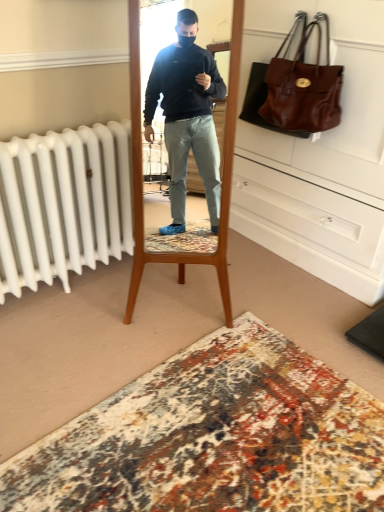
Describe the element at coordinates (319, 155) in the screenshot. I see `matte brown leather dresser at upper right` at that location.

This screenshot has height=512, width=384. What are the coordinates of `brown leather handbag at upper right` in the screenshot? It's located at (303, 85).

What is the approximate width of carpet with intricate patterns at lower center?

carpet with intricate patterns at lower center is 1.36 meters in width.

Find the location of a particular element. matte brown leather dresser at upper right is located at coordinates (319, 155).

Is brown leather handbag at upper right aimed at carpet with intricate patterns at lower center?

No, brown leather handbag at upper right is not facing towards carpet with intricate patterns at lower center.

How much distance is there between brown leather handbag at upper right and carpet with intricate patterns at lower center?

brown leather handbag at upper right is 4.43 feet from carpet with intricate patterns at lower center.

Does brown leather handbag at upper right have a lesser width compared to carpet with intricate patterns at lower center?

Yes, brown leather handbag at upper right is thinner than carpet with intricate patterns at lower center.

Is point (300, 68) closer to camera compared to point (164, 379)?

No, (300, 68) is behind (164, 379).

From a real-world perspective, is matte brown leather dresser at upper right positioned above or below carpet with intricate patterns at lower center?

matte brown leather dresser at upper right is situated higher than carpet with intricate patterns at lower center in the real world.

Are matte brown leather dresser at upper right and carpet with intricate patterns at lower center located far from each other?

matte brown leather dresser at upper right is far away from carpet with intricate patterns at lower center.

Would you say matte brown leather dresser at upper right is to the left or to the right of carpet with intricate patterns at lower center in the picture?

Clearly, matte brown leather dresser at upper right is on the right of carpet with intricate patterns at lower center in the image.

Do you think matte brown leather dresser at upper right is within carpet with intricate patterns at lower center, or outside of it?

matte brown leather dresser at upper right is outside carpet with intricate patterns at lower center.

Which of these two, carpet with intricate patterns at lower center or brown leather handbag at upper right, is smaller?

brown leather handbag at upper right.

Where is `handbag that appears above the carpet with intricate patterns at lower center (from a real-world perspective)`? This screenshot has width=384, height=512. handbag that appears above the carpet with intricate patterns at lower center (from a real-world perspective) is located at coordinates (303, 85).

Consider the image. In terms of height, does carpet with intricate patterns at lower center look taller or shorter compared to brown leather handbag at upper right?

Clearly, carpet with intricate patterns at lower center is shorter compared to brown leather handbag at upper right.

Is brown leather handbag at upper right a part of carpet with intricate patterns at lower center?

No.

Relative to matte brown leather dresser at upper right, is brown leather handbag at upper right in front or behind?

Visually, brown leather handbag at upper right is located behind matte brown leather dresser at upper right.

This screenshot has height=512, width=384. What are the coordinates of `dresser below the brown leather handbag at upper right (from the image's perspective)` in the screenshot? It's located at (319, 155).

From a real-world perspective, is brown leather handbag at upper right physically below matte brown leather dresser at upper right?

No.

From the image's perspective, who appears lower, brown leather handbag at upper right or matte brown leather dresser at upper right?

matte brown leather dresser at upper right is shown below in the image.

Is matte brown leather dresser at upper right directly adjacent to brown leather handbag at upper right?

No, matte brown leather dresser at upper right is not next to brown leather handbag at upper right.

Can you confirm if matte brown leather dresser at upper right is smaller than brown leather handbag at upper right?

No, matte brown leather dresser at upper right is not smaller than brown leather handbag at upper right.

Does point (239, 149) come behind point (307, 103)?

That is True.

Is carpet with intricate patterns at lower center turned away from matte brown leather dresser at upper right?

carpet with intricate patterns at lower center is not turned away from matte brown leather dresser at upper right.

Is carpet with intricate patterns at lower center touching matte brown leather dresser at upper right?

No, carpet with intricate patterns at lower center is not touching matte brown leather dresser at upper right.

Is carpet with intricate patterns at lower center surrounding matte brown leather dresser at upper right?

No, matte brown leather dresser at upper right is not inside carpet with intricate patterns at lower center.

Is carpet with intricate patterns at lower center to the left of matte brown leather dresser at upper right from the viewer's perspective?

Yes.

The width and height of the screenshot is (384, 512). In order to click on handbag that is on the right side of carpet with intricate patterns at lower center in this screenshot , I will do `click(303, 85)`.

Find the location of a particular element. plain to the left of matte brown leather dresser at upper right is located at coordinates (214, 437).

Looking at the image, which one is located closer to matte brown leather dresser at upper right, brown leather handbag at upper right or carpet with intricate patterns at lower center?

The object closer to matte brown leather dresser at upper right is brown leather handbag at upper right.

Which object lies nearer to the anchor point brown leather handbag at upper right, carpet with intricate patterns at lower center or matte brown leather dresser at upper right?

Among the two, matte brown leather dresser at upper right is located nearer to brown leather handbag at upper right.

Considering their positions, is carpet with intricate patterns at lower center positioned further to matte brown leather dresser at upper right than brown leather handbag at upper right?

carpet with intricate patterns at lower center is positioned further to the anchor matte brown leather dresser at upper right.

Looking at the image, which one is located closer to carpet with intricate patterns at lower center, matte brown leather dresser at upper right or brown leather handbag at upper right?

Based on the image, matte brown leather dresser at upper right appears to be nearer to carpet with intricate patterns at lower center.

Based on their spatial positions, is brown leather handbag at upper right or matte brown leather dresser at upper right closer to carpet with intricate patterns at lower center?

matte brown leather dresser at upper right is positioned closer to the anchor carpet with intricate patterns at lower center.

Looking at the image, which one is located closer to brown leather handbag at upper right, matte brown leather dresser at upper right or carpet with intricate patterns at lower center?

Among the two, matte brown leather dresser at upper right is located nearer to brown leather handbag at upper right.

The image size is (384, 512). Find the location of `dresser between brown leather handbag at upper right and carpet with intricate patterns at lower center vertically`. dresser between brown leather handbag at upper right and carpet with intricate patterns at lower center vertically is located at coordinates (319, 155).